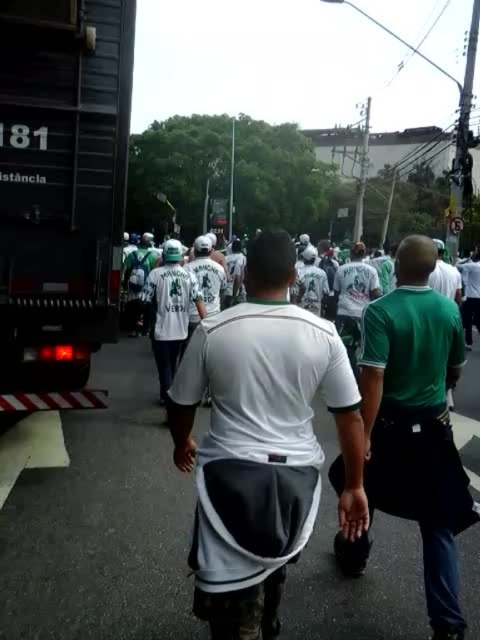
Does dark gray metal truck at left have a larger size compared to white matte shirt at center?

Yes, dark gray metal truck at left is bigger than white matte shirt at center.

Is point (15, 81) less distant than point (288, 429)?

That is False.

Describe the element at coordinates (61, 179) in the screenshot. I see `dark gray metal truck at left` at that location.

Identify the location of dark gray metal truck at left. (61, 179).

The width and height of the screenshot is (480, 640). What do you see at coordinates (269, 381) in the screenshot? I see `white matte shirt at center` at bounding box center [269, 381].

Is white matte shirt at center shorter than green matte shirt at center?

Indeed, white matte shirt at center has a lesser height compared to green matte shirt at center.

What are the coordinates of `white matte shirt at center` in the screenshot? It's located at (269, 381).

Where is `white matte shirt at center`? white matte shirt at center is located at coordinates (269, 381).

Who is taller, dark gray metal truck at left or green matte shirt at center?

dark gray metal truck at left

In the scene shown: Between dark gray metal truck at left and green matte shirt at center, which one appears on the right side from the viewer's perspective?

Positioned to the right is green matte shirt at center.

Between point (23, 278) and point (388, 477), which one is positioned behind?

Positioned behind is point (23, 278).

Where is `dark gray metal truck at left`? This screenshot has height=640, width=480. dark gray metal truck at left is located at coordinates (61, 179).